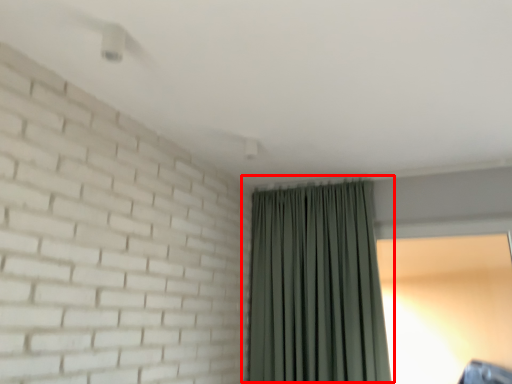
Question: From the image's perspective, what is the correct spatial relationship of curtain (annotated by the red box) in relation to window screen?

Choices:
 (A) above
 (B) below

Answer: (A)